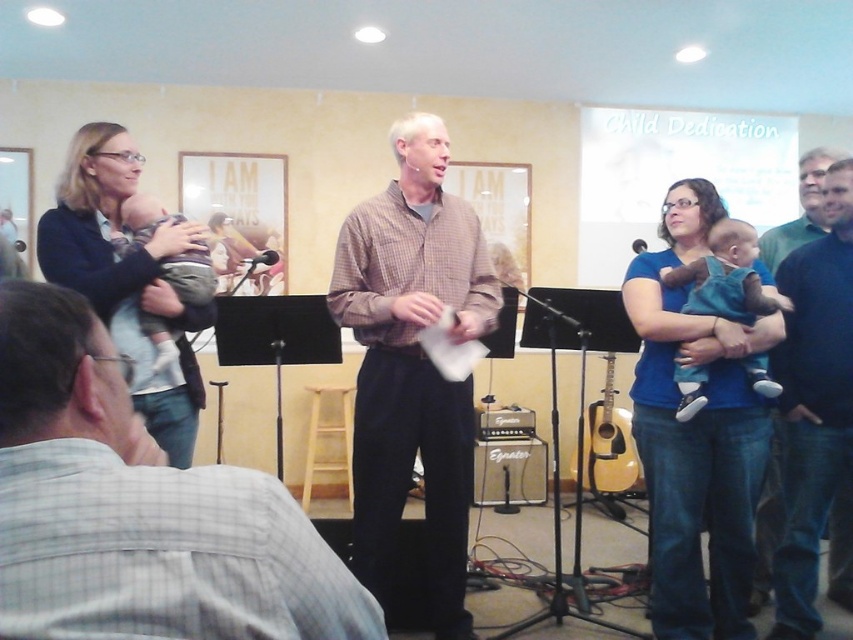
Is dark blue sweater at right to the right of metallic silver microphone at center from the viewer's perspective?

Correct, you'll find dark blue sweater at right to the right of metallic silver microphone at center.

Is dark blue sweater at right wider than metallic silver microphone at center?

Yes, dark blue sweater at right is wider than metallic silver microphone at center.

Does point (817, 506) come in front of point (642, 244)?

Yes, point (817, 506) is closer to viewer.

This screenshot has height=640, width=853. I want to click on dark blue sweater at right, so click(813, 403).

Does light brown fabric baby at center have a smaller size compared to metallic silver microphone at center?

Incorrect, light brown fabric baby at center is not smaller in size than metallic silver microphone at center.

Can you confirm if light brown fabric baby at center is thinner than metallic silver microphone at center?

No.

Which is in front, point (192, 253) or point (637, 244)?

Point (192, 253) is in front.

Locate an element on the screen. light brown fabric baby at center is located at coordinates (190, 275).

Can you confirm if light brown fabric baby at center is shorter than black plastic microphone at center?

Incorrect, light brown fabric baby at center's height does not fall short of black plastic microphone at center's.

You are a GUI agent. You are given a task and a screenshot of the screen. Output one action in this format:
    pyautogui.click(x=<x>, y=<y>)
    Task: Click on the light brown fabric baby at center
    The width and height of the screenshot is (853, 640).
    Given the screenshot: What is the action you would take?
    pyautogui.click(x=190, y=275)

I want to click on light brown fabric baby at center, so click(190, 275).